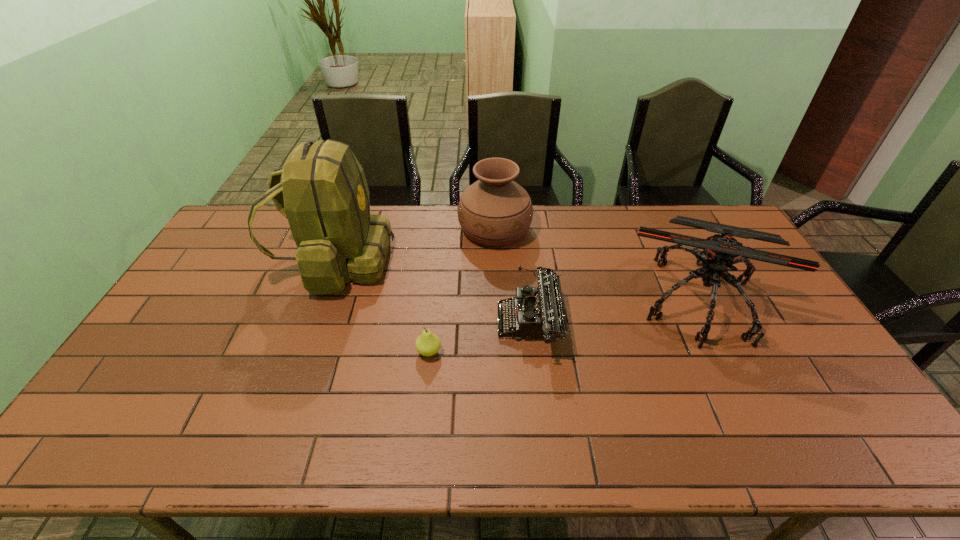
Identify which object is located as the fourth nearest to the urn. Please provide its 2D coordinates. Your answer should be formatted as a tuple, i.e. [(x, y)], where the tuple contains the x and y coordinates of a point satisfying the conditions above.

[(427, 344)]

The height and width of the screenshot is (540, 960). In order to click on object that is the fourth closest to the pear in this screenshot , I will do `click(720, 252)`.

Find the location of `free space that satisfies the following two spatial constraints: 1. on the front side of the rightmost object; 2. on the right side of the urn`. free space that satisfies the following two spatial constraints: 1. on the front side of the rightmost object; 2. on the right side of the urn is located at coordinates (497, 299).

Image resolution: width=960 pixels, height=540 pixels. I want to click on free location that satisfies the following two spatial constraints: 1. on the back side of the urn; 2. on the right side of the pear, so click(442, 229).

The image size is (960, 540). I want to click on free spot that satisfies the following two spatial constraints: 1. on the front-facing side of the leftmost object; 2. on the back side of the pear, so click(x=301, y=352).